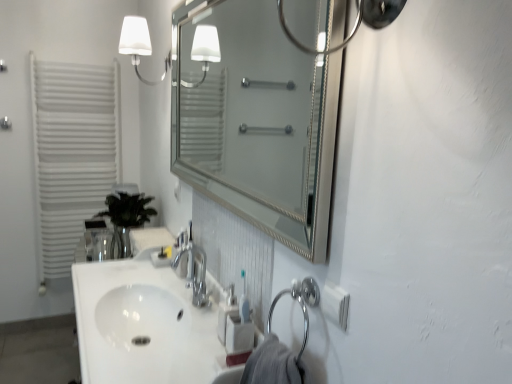
Question: In the image, is white glossy sink at center, which is counted as the 1th sink, starting from the bottom, positioned in front of or behind silver/metallic mirror at center?

Choices:
 (A) front
 (B) behind

Answer: (B)

Question: From the image's perspective, is white glossy sink at center, the second sink in the top-to-bottom sequence, above or below silver/metallic mirror at center?

Choices:
 (A) below
 (B) above

Answer: (A)

Question: Which object is positioned farthest from the white matte wall sconce at upper left?

Choices:
 (A) chrome metallic faucet at center
 (B) green glass vase at left
 (C) white glossy sink at center, the second sink ordered from the bottom
 (D) white plastic soap dispenser at lower center
 (E) white glossy sink at center, which is counted as the 1th sink, starting from the bottom

Answer: (D)

Question: Based on their relative distances, which object is nearer to the white glossy sink at center, which is counted as the 1th sink, starting from the bottom?

Choices:
 (A) chrome metallic faucet at center
 (B) white plastic soap dispenser at lower center
 (C) white glossy sink at center, the second sink ordered from the bottom
 (D) silver/metallic mirror at center
 (E) green glass vase at left

Answer: (C)